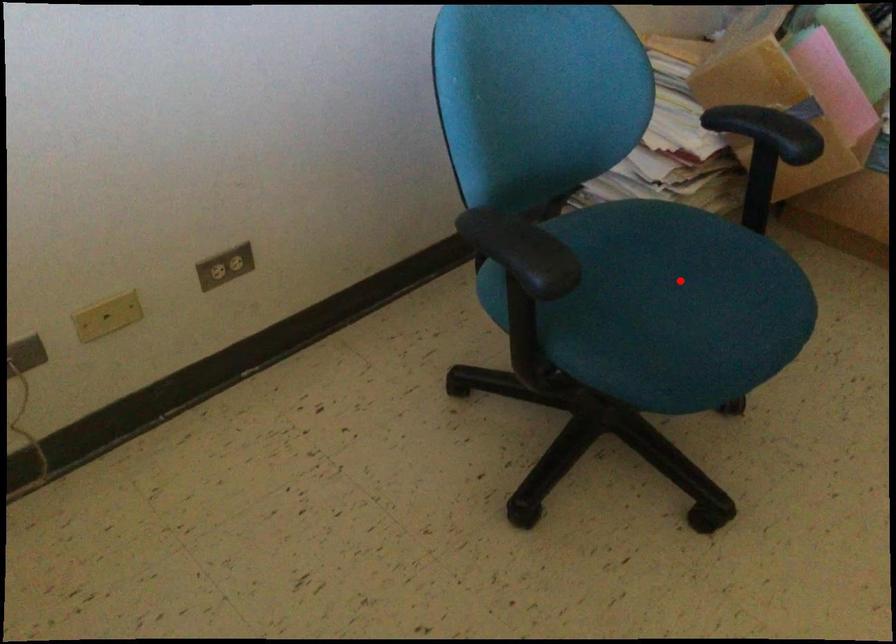
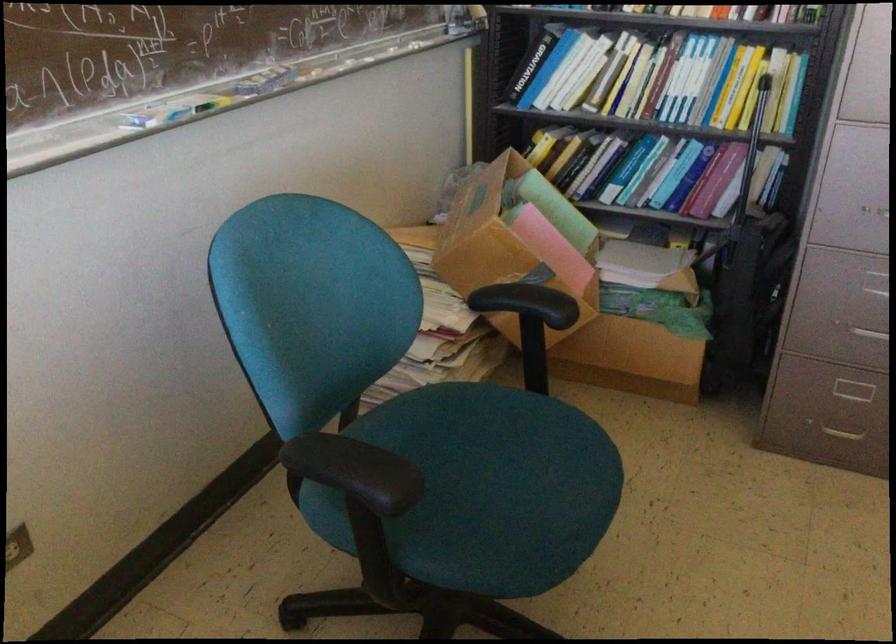
Question: I am providing you with two images of the same scene from different viewpoints. A red point is marked on the first image. Is the red point's position out of view in image 2?

Choices:
 (A) Yes
 (B) No

Answer: (B)